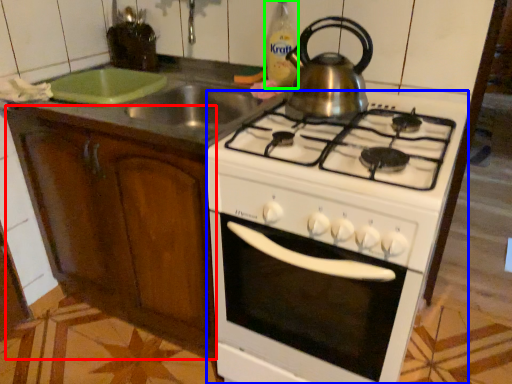
Question: Estimate the real-world distances between objects in this image. Which object is farther from cabinetry (highlighted by a red box), oven (highlighted by a blue box) or bottle (highlighted by a green box)?

Choices:
 (A) oven
 (B) bottle

Answer: (B)